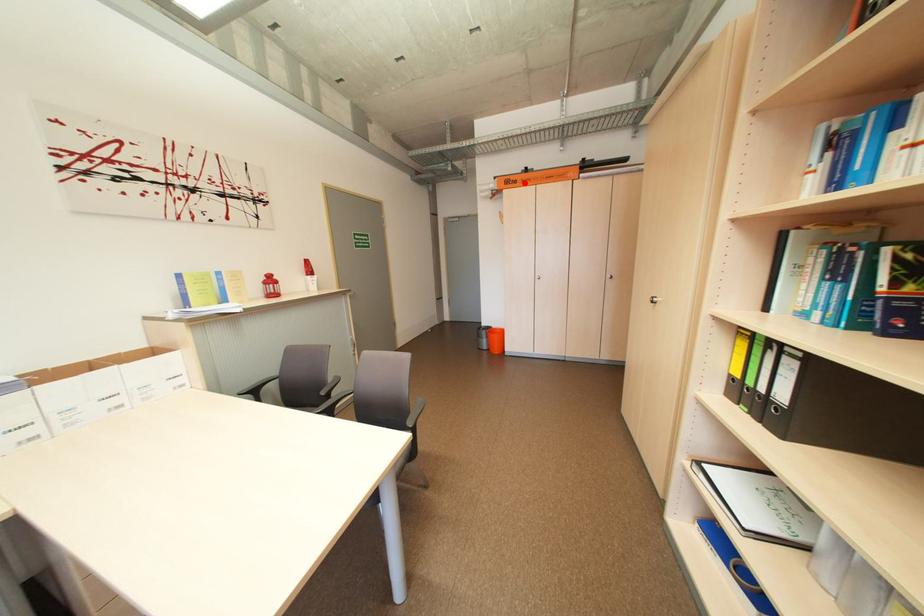
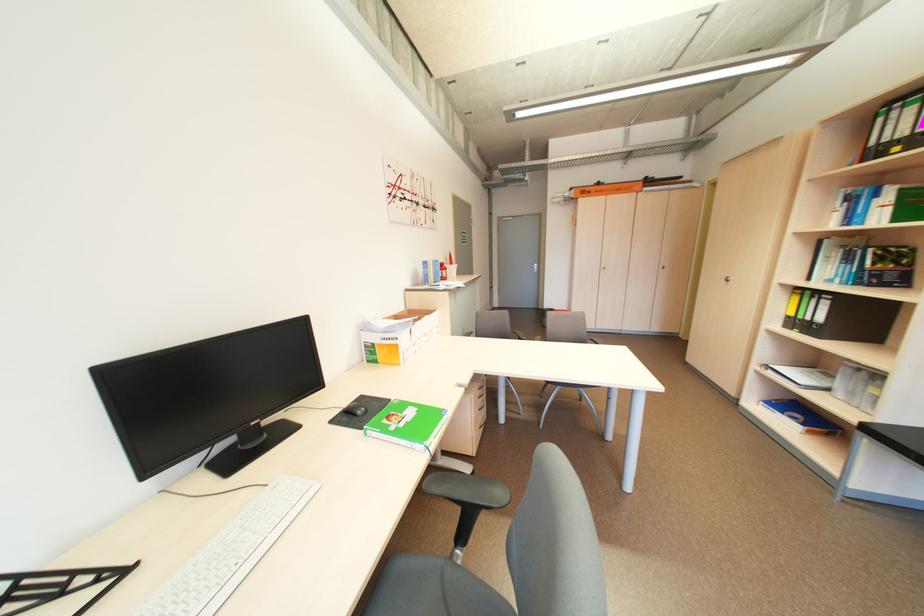
Find the pixel in the second image that matches the highlighted location in the first image.

(599, 193)